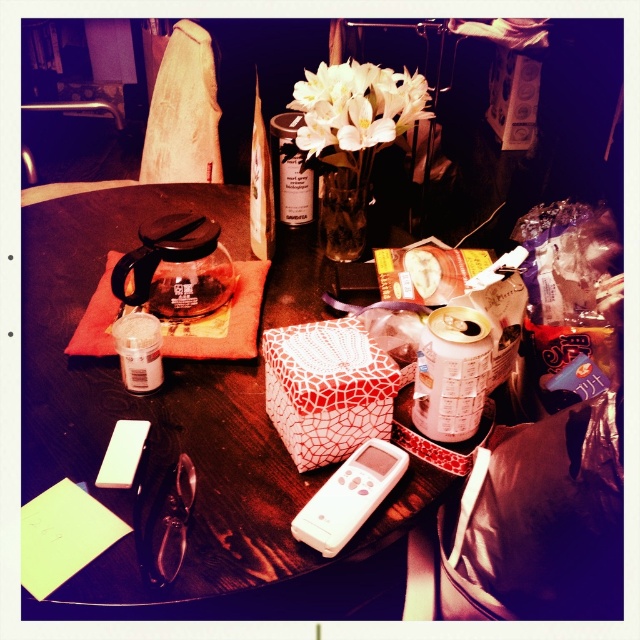
You are sitting at the dark wooden table and want to grab the white plastic remote at center to change the TV channel. However, the white glossy flowers at center are blocking your direct path. Can you reach the remote without moving the flowers?

The white glossy flowers at center are further to the viewer than the white plastic remote at center, meaning the remote is closer to you. Since the flowers are between you and the remote, you can reach the remote without moving the flowers because it is closer and not obstructed by them.

You are organizing the items on the dark wooden table at center. You need to place both the white glossy flowers at center and the white plastic remote at center in a way that the larger item is on the left side. Which item should you place on the left?

The white glossy flowers at center is larger than the white plastic remote at center, so you should place the white glossy flowers at center on the left side.

You are standing in front of the dark wooden table and want to reach both the point at (330, 125) and the point at (353, 502). Which point will you touch first if you move your hand towards the table?

You will touch point at (330, 125) first because it is closer to you than point at (353, 502).